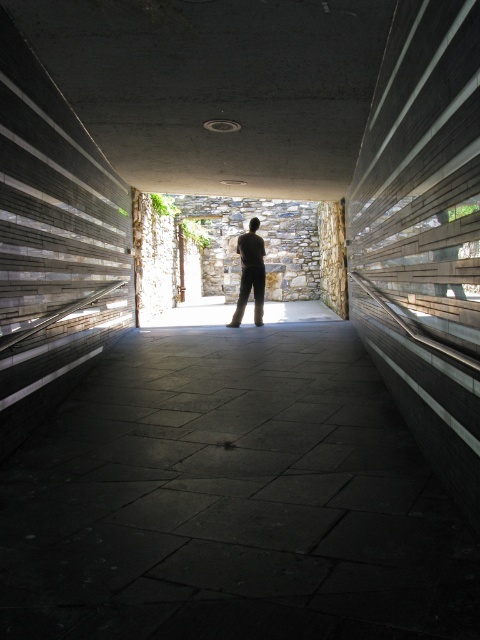
You are standing at the entrance of the corridor and want to reach the dark stone pavement at center. According to the coordinates provided, in which direction should you move relative to your current position?

The dark stone pavement at center is located at coordinates point (231, 499), so you should move forward along the corridor towards the center to reach it.

You are standing at the entrance of the corridor and see the stone wall at center and the dark brown pants at center. Which object takes up more space in the image?

The dark brown pants at center occupies more space than the stone wall at center.

You are standing in the corridor and notice the dark stone pavement at center and the dark brown pants at center. Which object is positioned lower in the scene?

The dark stone pavement at center is located below the dark brown pants at center, so it is positioned lower in the scene.